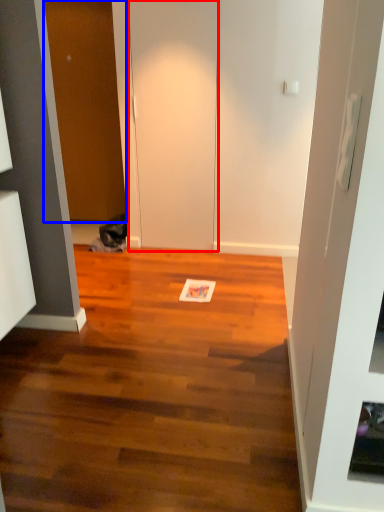
Question: Among these objects, which one is nearest to the camera, door (highlighted by a red box) or door (highlighted by a blue box)?

Choices:
 (A) door
 (B) door

Answer: (A)